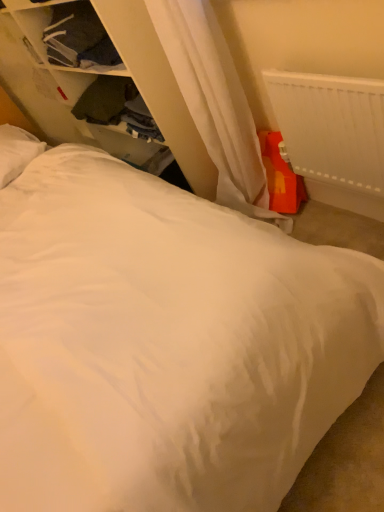
From the picture: In order to face white soft pillow at upper left, should I rotate leftwards or rightwards?

Turn left by 24.007 degrees to look at white soft pillow at upper left.

Describe the element at coordinates (76, 80) in the screenshot. I see `white fabric dresser at upper left` at that location.

Locate an element on the screen. This screenshot has height=512, width=384. dark blue fabric at upper left, the 2th clothing positioned from the bottom is located at coordinates (78, 37).

Between white soft pillow at upper left and white plastic radiator at upper right, which one appears on the right side from the viewer's perspective?

white plastic radiator at upper right is more to the right.

Considering the points (17, 149) and (319, 156), which point is in front, point (17, 149) or point (319, 156)?

The point (319, 156) is closer to the camera.

Is white soft pillow at upper left far from white plastic radiator at upper right?

That's right, there is a large distance between white soft pillow at upper left and white plastic radiator at upper right.

Is white soft pillow at upper left looking in the opposite direction of white plastic radiator at upper right?

No, white soft pillow at upper left is not facing the opposite direction of white plastic radiator at upper right.

Is white plastic radiator at upper right aimed at dark green fabric at upper left, the 1th clothing in the bottom-to-top sequence?

No, white plastic radiator at upper right is not turned towards dark green fabric at upper left, the 1th clothing in the bottom-to-top sequence.

Is white plastic radiator at upper right beside dark green fabric at upper left, the 1th clothing in the bottom-to-top sequence?

No, white plastic radiator at upper right is not next to dark green fabric at upper left, the 1th clothing in the bottom-to-top sequence.

In the scene shown: From a real-world perspective, is white plastic radiator at upper right above or below dark green fabric at upper left, positioned as the 2th clothing in top-to-bottom order?

In terms of real-world spatial position, white plastic radiator at upper right is below dark green fabric at upper left, positioned as the 2th clothing in top-to-bottom order.

Does point (21, 100) appear closer or farther from the camera than point (114, 103)?

Point (21, 100) appears to be farther away from the viewer than point (114, 103).

Would you say white fabric dresser at upper left is a long distance from dark green fabric at upper left, the 1th clothing in the bottom-to-top sequence?

No, white fabric dresser at upper left is in close proximity to dark green fabric at upper left, the 1th clothing in the bottom-to-top sequence.

Which object is further away from the camera, white fabric dresser at upper left or dark green fabric at upper left, the 1th clothing in the bottom-to-top sequence?

dark green fabric at upper left, the 1th clothing in the bottom-to-top sequence.

Based on their sizes in the image, would you say white fabric dresser at upper left is bigger or smaller than dark green fabric at upper left, positioned as the 2th clothing in top-to-bottom order?

Considering their sizes, white fabric dresser at upper left takes up more space than dark green fabric at upper left, positioned as the 2th clothing in top-to-bottom order.

At what (x,y) coordinates should I click in order to perform the action: click on radiator in front of the white soft pillow at upper left. Please return your answer as a coordinate pair (x, y). The width and height of the screenshot is (384, 512). Looking at the image, I should click on (331, 127).

From the image's perspective, is white plastic radiator at upper right located above white soft pillow at upper left?

No, from the image's perspective, white plastic radiator at upper right is not above white soft pillow at upper left.

Is white plastic radiator at upper right next to white soft pillow at upper left?

No.

From a real-world perspective, is white fabric dresser at upper left on top of white plastic radiator at upper right?

Yes, from a real-world perspective, white fabric dresser at upper left is on top of white plastic radiator at upper right.

Considering the positions of objects white fabric dresser at upper left and white plastic radiator at upper right in the image provided, who is more to the right, white fabric dresser at upper left or white plastic radiator at upper right?

white plastic radiator at upper right is more to the right.

Considering their positions, is white fabric dresser at upper left located in front of or behind white plastic radiator at upper right?

Visually, white fabric dresser at upper left is located behind white plastic radiator at upper right.

Based on the photo, could white plastic radiator at upper right be considered to be inside white fabric dresser at upper left?

Actually, white plastic radiator at upper right is outside white fabric dresser at upper left.

The width and height of the screenshot is (384, 512). Identify the location of clothing that appears above the white fabric dresser at upper left (from a real-world perspective). (78, 37).

From a real-world perspective, is dark blue fabric at upper left, the 2th clothing positioned from the bottom, beneath white fabric dresser at upper left?

No, from a real-world perspective, dark blue fabric at upper left, the 2th clothing positioned from the bottom, is not under white fabric dresser at upper left.

How different are the orientations of dark blue fabric at upper left, placed as the first clothing when sorted from top to bottom, and white fabric dresser at upper left in degrees?

They differ by 0.326 degrees in their facing directions.

Is dark blue fabric at upper left, the 2th clothing positioned from the bottom, positioned behind white fabric dresser at upper left?

Yes, it is behind white fabric dresser at upper left.

From a real-world perspective, does white soft pillow at upper left stand above dark green fabric at upper left, positioned as the 2th clothing in top-to-bottom order?

Yes, from a real-world perspective, white soft pillow at upper left is on top of dark green fabric at upper left, positioned as the 2th clothing in top-to-bottom order.

Based on the photo, can you tell me how much white soft pillow at upper left and dark green fabric at upper left, positioned as the 2th clothing in top-to-bottom order, differ in facing direction?

The facing directions of white soft pillow at upper left and dark green fabric at upper left, positioned as the 2th clothing in top-to-bottom order, are 89.8 degrees apart.

Which is further, (40, 141) or (102, 125)?

Point (40, 141)

Considering the relative positions of white soft pillow at upper left and dark green fabric at upper left, the 1th clothing in the bottom-to-top sequence, in the image provided, is white soft pillow at upper left in front of dark green fabric at upper left, the 1th clothing in the bottom-to-top sequence,?

Yes, the depth of white soft pillow at upper left is less than that of dark green fabric at upper left, the 1th clothing in the bottom-to-top sequence.

What are the coordinates of `radiator below the white soft pillow at upper left (from a real-world perspective)` in the screenshot? It's located at (331, 127).

Locate an element on the screen. the 1st clothing located above the white plastic radiator at upper right (from a real-world perspective) is located at coordinates (116, 106).

Based on their spatial positions, is dark green fabric at upper left, positioned as the 2th clothing in top-to-bottom order, or white soft pillow at upper left closer to white plastic radiator at upper right?

Among the two, dark green fabric at upper left, positioned as the 2th clothing in top-to-bottom order, is located nearer to white plastic radiator at upper right.

Which object lies further to the anchor point white soft pillow at upper left, white plastic radiator at upper right or dark green fabric at upper left, positioned as the 2th clothing in top-to-bottom order?

white plastic radiator at upper right lies further to white soft pillow at upper left than the other object.

Estimate the real-world distances between objects in this image. Which object is further from dark green fabric at upper left, positioned as the 2th clothing in top-to-bottom order, white fabric dresser at upper left or dark blue fabric at upper left, the 2th clothing positioned from the bottom?

Among the two, dark blue fabric at upper left, the 2th clothing positioned from the bottom, is located further to dark green fabric at upper left, positioned as the 2th clothing in top-to-bottom order.

Considering their positions, is dark green fabric at upper left, the 1th clothing in the bottom-to-top sequence, positioned closer to dark blue fabric at upper left, placed as the first clothing when sorted from top to bottom, than white soft pillow at upper left?

Among the two, dark green fabric at upper left, the 1th clothing in the bottom-to-top sequence, is located nearer to dark blue fabric at upper left, placed as the first clothing when sorted from top to bottom.

Considering their positions, is white fabric dresser at upper left positioned further to white soft pillow at upper left than dark blue fabric at upper left, the 2th clothing positioned from the bottom?

dark blue fabric at upper left, the 2th clothing positioned from the bottom, is further to white soft pillow at upper left.

From the image, which object appears to be nearer to white plastic radiator at upper right, dark blue fabric at upper left, placed as the first clothing when sorted from top to bottom, or dark green fabric at upper left, positioned as the 2th clothing in top-to-bottom order?

dark green fabric at upper left, positioned as the 2th clothing in top-to-bottom order, is positioned closer to the anchor white plastic radiator at upper right.

From the image, which object appears to be farther from white fabric dresser at upper left, dark blue fabric at upper left, the 2th clothing positioned from the bottom, or dark green fabric at upper left, the 1th clothing in the bottom-to-top sequence?

dark blue fabric at upper left, the 2th clothing positioned from the bottom.

Based on their spatial positions, is white fabric dresser at upper left or white soft pillow at upper left further from dark green fabric at upper left, the 1th clothing in the bottom-to-top sequence?

white soft pillow at upper left is further to dark green fabric at upper left, the 1th clothing in the bottom-to-top sequence.

The image size is (384, 512). Find the location of `dresser situated between white soft pillow at upper left and white plastic radiator at upper right from left to right`. dresser situated between white soft pillow at upper left and white plastic radiator at upper right from left to right is located at coordinates (76, 80).

The height and width of the screenshot is (512, 384). In order to click on clothing between dark blue fabric at upper left, placed as the first clothing when sorted from top to bottom, and white plastic radiator at upper right from left to right in this screenshot , I will do `click(116, 106)`.

At what (x,y) coordinates should I click in order to perform the action: click on dresser located between dark green fabric at upper left, the 1th clothing in the bottom-to-top sequence, and white plastic radiator at upper right in the left-right direction. Please return your answer as a coordinate pair (x, y). This screenshot has height=512, width=384. Looking at the image, I should click on (76, 80).

Locate an element on the screen. clothing between white soft pillow at upper left and dark green fabric at upper left, positioned as the 2th clothing in top-to-bottom order, from left to right is located at coordinates [78, 37].